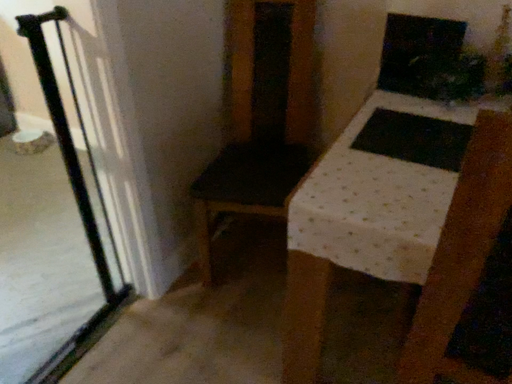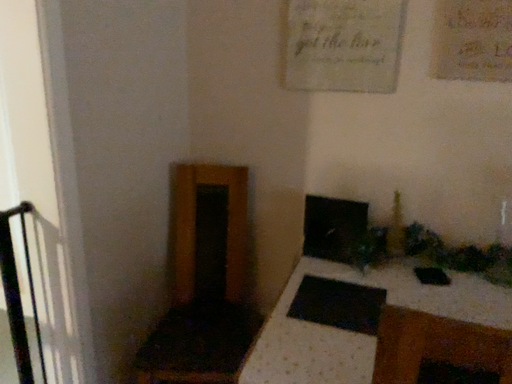
Question: Which way did the camera rotate in the video?

Choices:
 (A) rotated upward
 (B) rotated downward

Answer: (A)